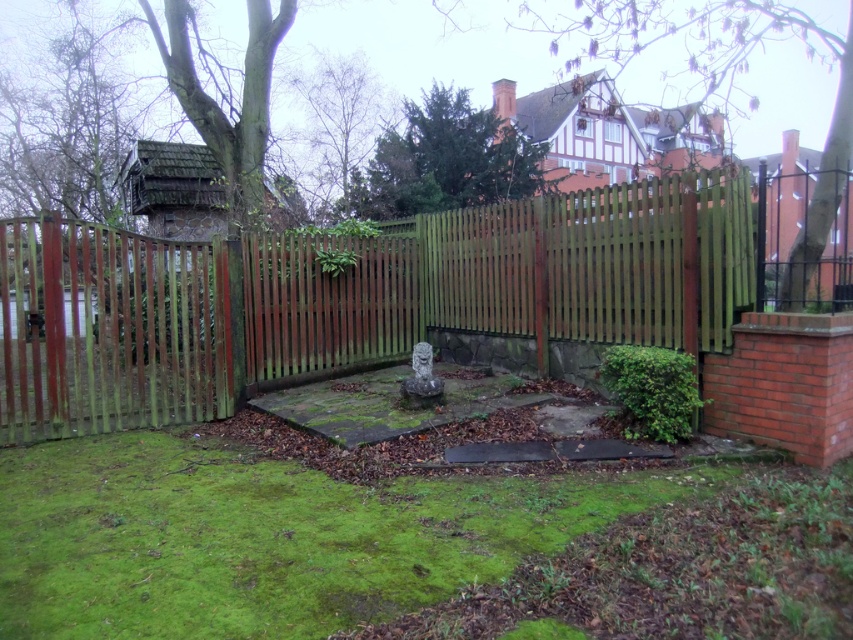
Is green wooden fence at center bigger than green mossy grass at center?

No.

Is point (705, 240) in front of point (184, 445)?

Yes, point (705, 240) is in front of point (184, 445).

Locate an element on the screen. green wooden fence at center is located at coordinates (374, 301).